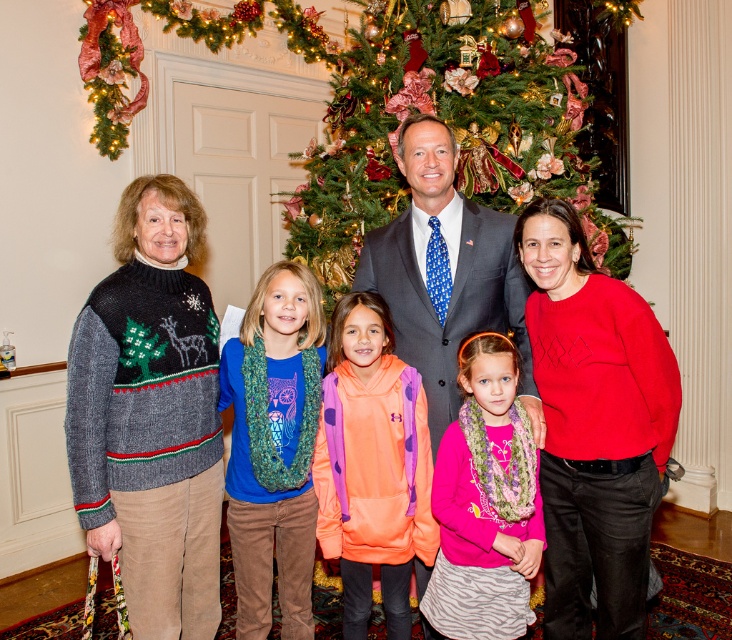
Between green textured christmas tree at center and orange fleece hoodie at center, which one has less height?

orange fleece hoodie at center is shorter.

Which is more to the right, green textured christmas tree at center or orange fleece hoodie at center?

green textured christmas tree at center is more to the right.

Where is `green textured christmas tree at center`? The height and width of the screenshot is (640, 732). green textured christmas tree at center is located at coordinates (447, 124).

What are the coordinates of `green textured christmas tree at center` in the screenshot? It's located at (447, 124).

The height and width of the screenshot is (640, 732). Identify the location of orange fleece hoodie at center. (373, 465).

Looking at this image, does orange fleece hoodie at center have a larger size compared to knitted sweater at center?

No, orange fleece hoodie at center is not bigger than knitted sweater at center.

Is point (362, 352) less distant than point (436, 289)?

Yes.

This screenshot has width=732, height=640. In order to click on orange fleece hoodie at center in this screenshot , I will do `click(373, 465)`.

Which is behind, point (258, 624) or point (332, 388)?

The point (258, 624) is behind.

The image size is (732, 640). Identify the location of blue knitted sweater at center. (272, 445).